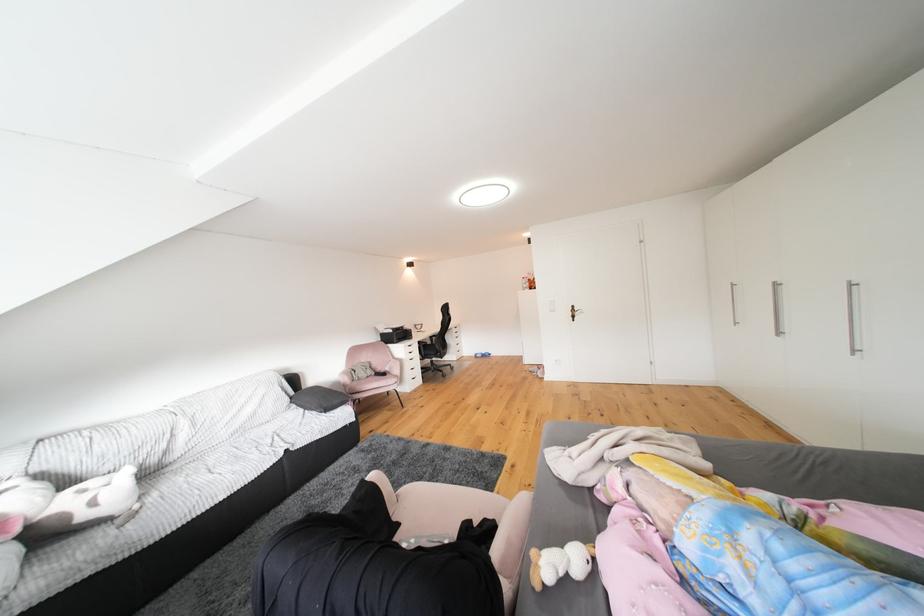
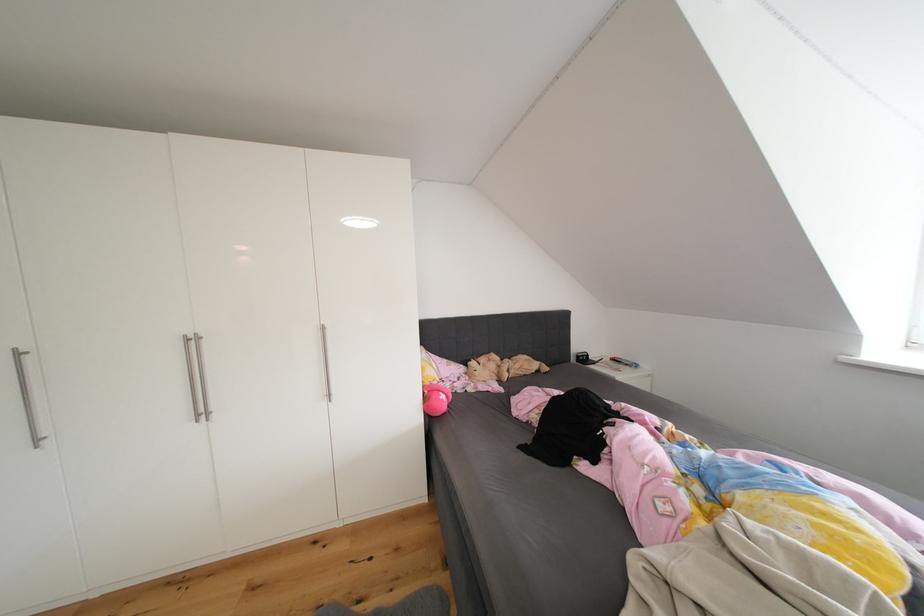
Locate, in the second image, the point that corresponds to point 785,289 in the first image.

(201, 344)